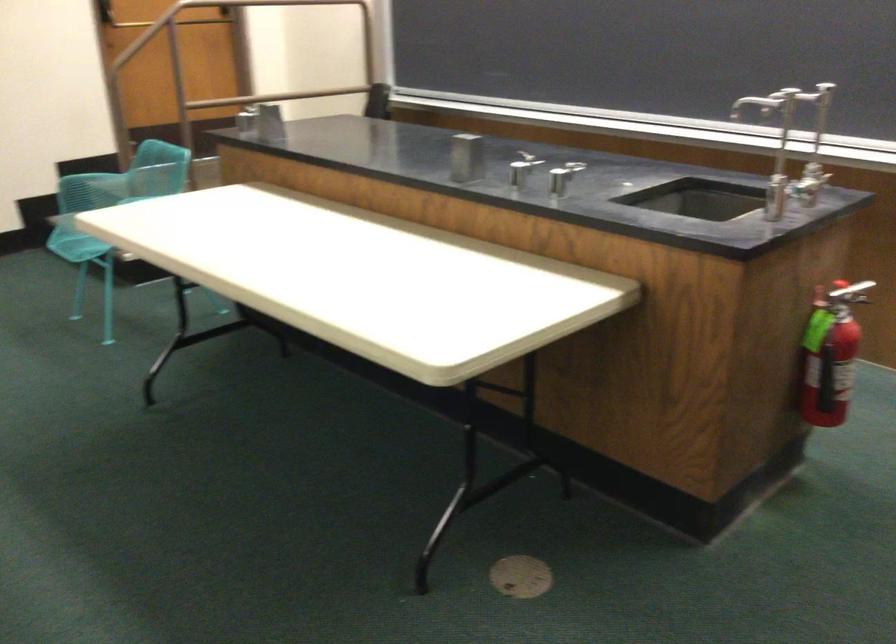
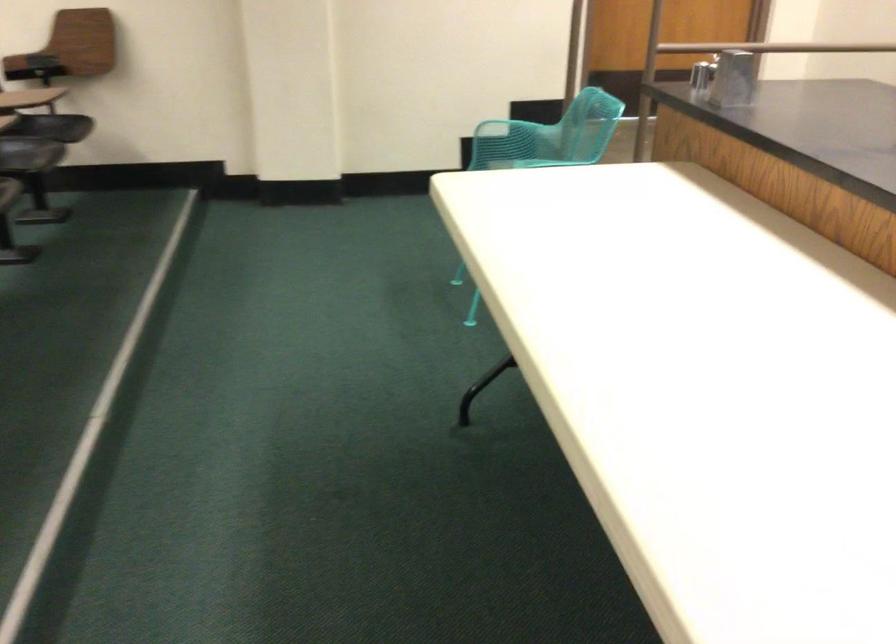
Question: The camera is either moving clockwise (left) or counter-clockwise (right) around the object. The first image is from the beginning of the video and the second image is from the end. Is the camera moving left or right when shooting the video?

Choices:
 (A) Left
 (B) Right

Answer: (B)